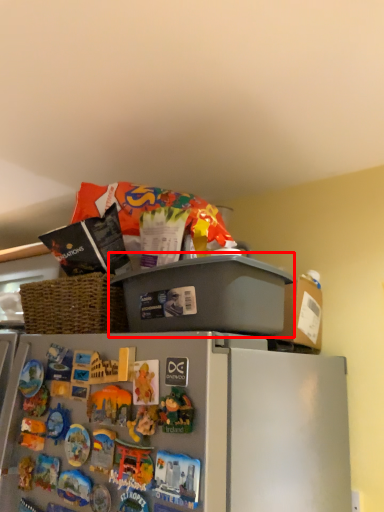
Question: From the image's perspective, considering the relative positions of appliance (annotated by the red box) and toy in the image provided, where is appliance (annotated by the red box) located with respect to the staircase?

Choices:
 (A) above
 (B) below

Answer: (A)